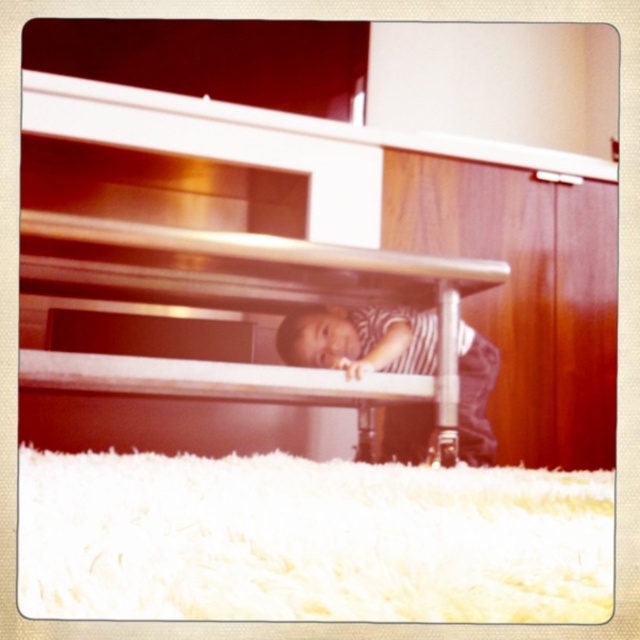
Can you confirm if matte white bunk bed at lower center is smaller than striped fabric toddler at lower center?

No.

Is matte white bunk bed at lower center above striped fabric toddler at lower center?

Yes.

Which is in front, point (433, 282) or point (401, 413)?

Positioned in front is point (433, 282).

Image resolution: width=640 pixels, height=640 pixels. Find the location of `matte white bunk bed at lower center`. matte white bunk bed at lower center is located at coordinates (236, 307).